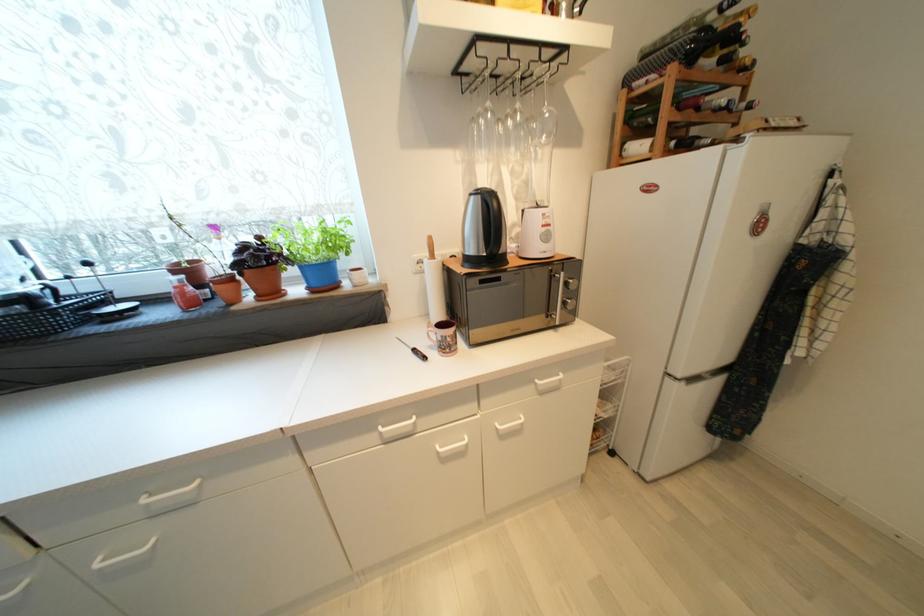
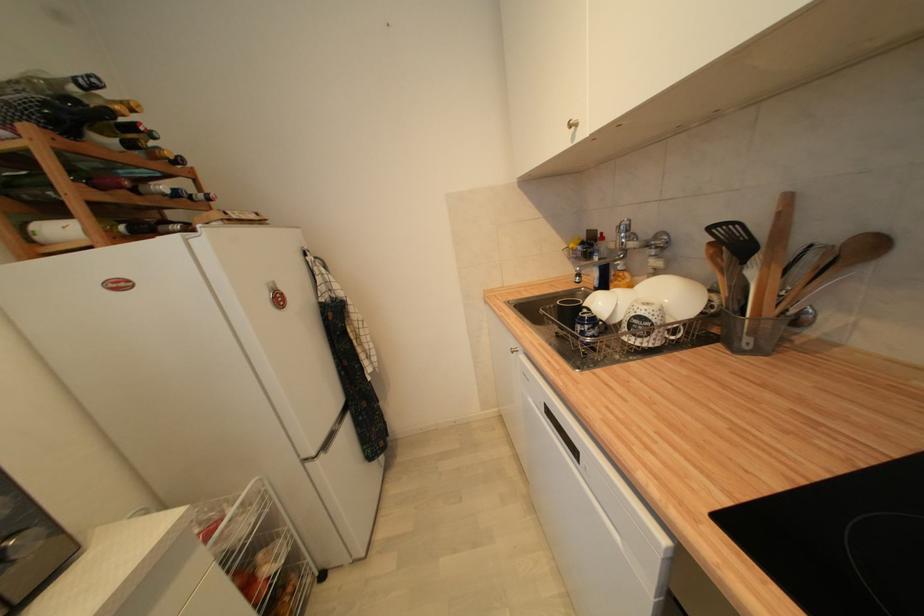
In the second image, find the point that corresponds to point (754, 70) in the first image.

(186, 164)